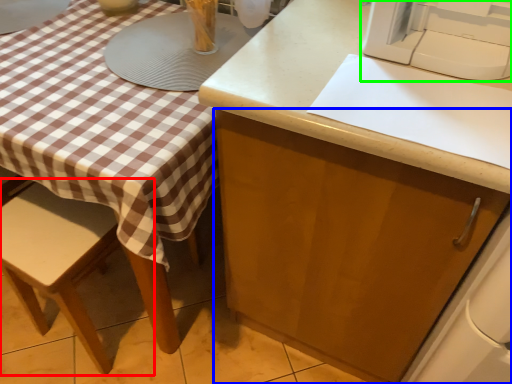
Question: Which object is the closest to the chair (highlighted by a red box)? Choose among these: cabinetry (highlighted by a blue box) or sewing machine (highlighted by a green box).

Choices:
 (A) cabinetry
 (B) sewing machine

Answer: (A)